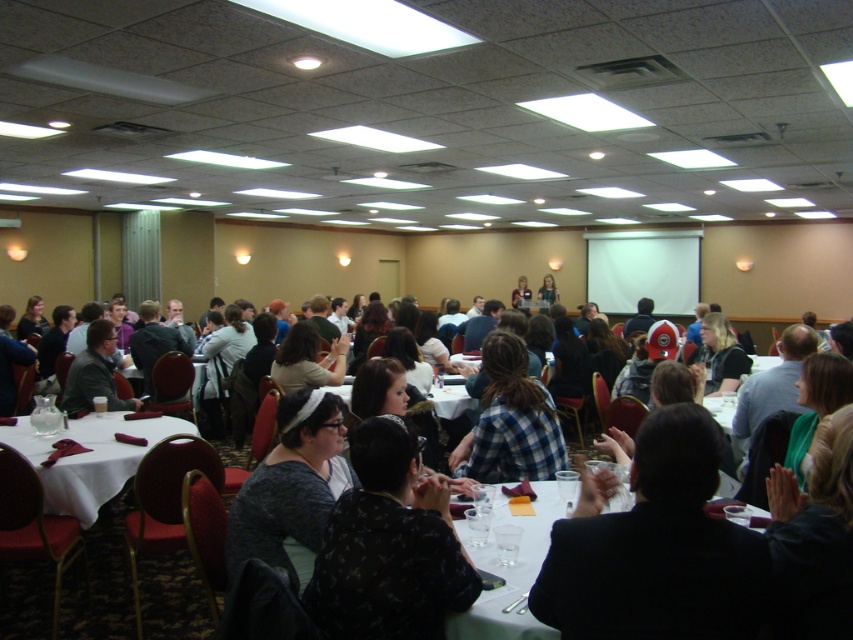
Question: Among these objects, which one is nearest to the camera?

Choices:
 (A) matte black jacket at center
 (B) dark gray fabric shirt at center
 (C) white cloth table at lower left

Answer: (B)

Question: Which point is farther from the camera taking this photo?

Choices:
 (A) (549, 468)
 (B) (22, 424)
 (C) (538, 524)

Answer: (B)

Question: Can you confirm if dark gray textured sweater at center is wider than blue plaid shirt at center?

Choices:
 (A) no
 (B) yes

Answer: (A)

Question: Can you confirm if dark gray fabric shirt at center is positioned below white glossy table at center?

Choices:
 (A) yes
 (B) no

Answer: (B)

Question: Does dark gray fabric shirt at center come in front of white glossy table at center?

Choices:
 (A) yes
 (B) no

Answer: (B)

Question: Which object is positioned closest to the dark gray fabric shirt at center?

Choices:
 (A) white glossy table at center
 (B) white cloth table at lower left

Answer: (A)